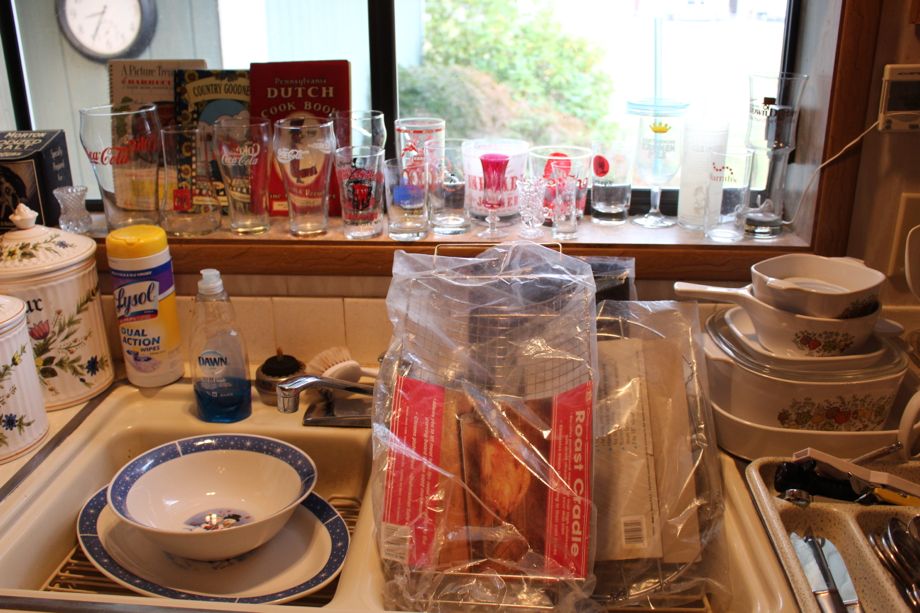
Locate an element on the screen. This screenshot has height=613, width=920. clock is located at coordinates (109, 12).